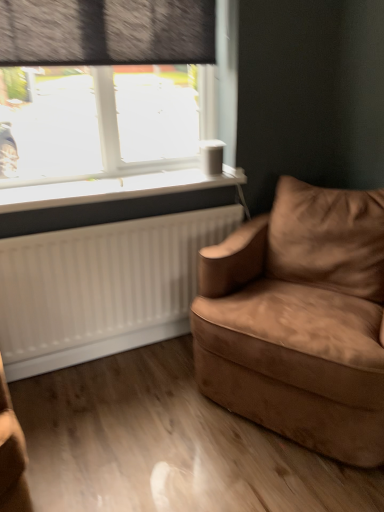
Question: Is dark gray textured curtain at upper left looking in the opposite direction of white plastic window sill at upper left?

Choices:
 (A) no
 (B) yes

Answer: (A)

Question: Is dark gray textured curtain at upper left aimed at white plastic window sill at upper left?

Choices:
 (A) yes
 (B) no

Answer: (B)

Question: Does dark gray textured curtain at upper left have a lesser height compared to white plastic window sill at upper left?

Choices:
 (A) yes
 (B) no

Answer: (B)

Question: Is dark gray textured curtain at upper left at the right side of white plastic window sill at upper left?

Choices:
 (A) yes
 (B) no

Answer: (B)

Question: Are dark gray textured curtain at upper left and white plastic window sill at upper left beside each other?

Choices:
 (A) no
 (B) yes

Answer: (A)

Question: Is suede brown armchair at right in front of or behind transparent glass window at upper left in the image?

Choices:
 (A) behind
 (B) front

Answer: (B)

Question: Is suede brown armchair at right inside the boundaries of transparent glass window at upper left, or outside?

Choices:
 (A) inside
 (B) outside

Answer: (B)

Question: In terms of size, does suede brown armchair at right appear bigger or smaller than transparent glass window at upper left?

Choices:
 (A) big
 (B) small

Answer: (A)

Question: Visually, is suede brown armchair at right positioned to the left or to the right of transparent glass window at upper left?

Choices:
 (A) right
 (B) left

Answer: (A)

Question: Relative to dark gray textured curtain at upper left, is suede brown armchair at right in front or behind?

Choices:
 (A) behind
 (B) front

Answer: (B)

Question: Looking at their shapes, would you say suede brown armchair at right is wider or thinner than dark gray textured curtain at upper left?

Choices:
 (A) thin
 (B) wide

Answer: (B)

Question: Looking at the image, does suede brown armchair at right seem bigger or smaller compared to dark gray textured curtain at upper left?

Choices:
 (A) small
 (B) big

Answer: (B)

Question: Based on their positions, is suede brown armchair at right located to the left or right of dark gray textured curtain at upper left?

Choices:
 (A) left
 (B) right

Answer: (B)

Question: Based on their sizes in the image, would you say transparent glass window at upper left is bigger or smaller than suede brown armchair at right?

Choices:
 (A) small
 (B) big

Answer: (A)

Question: Considering the positions of point [x=1, y=31] and point [x=322, y=210], is point [x=1, y=31] closer or farther from the camera than point [x=322, y=210]?

Choices:
 (A) closer
 (B) farther

Answer: (A)